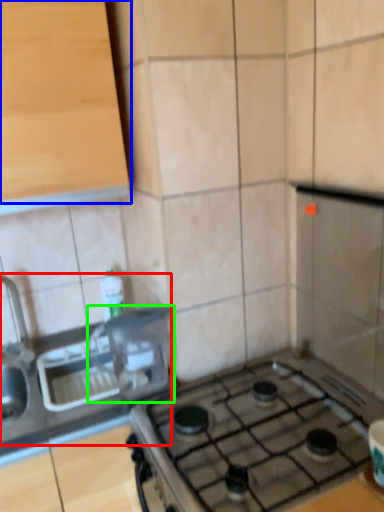
Question: Considering the real-world distances, which object is closest to sink (highlighted by a red box)? cabinetry (highlighted by a blue box) or appliance (highlighted by a green box).

Choices:
 (A) cabinetry
 (B) appliance

Answer: (B)